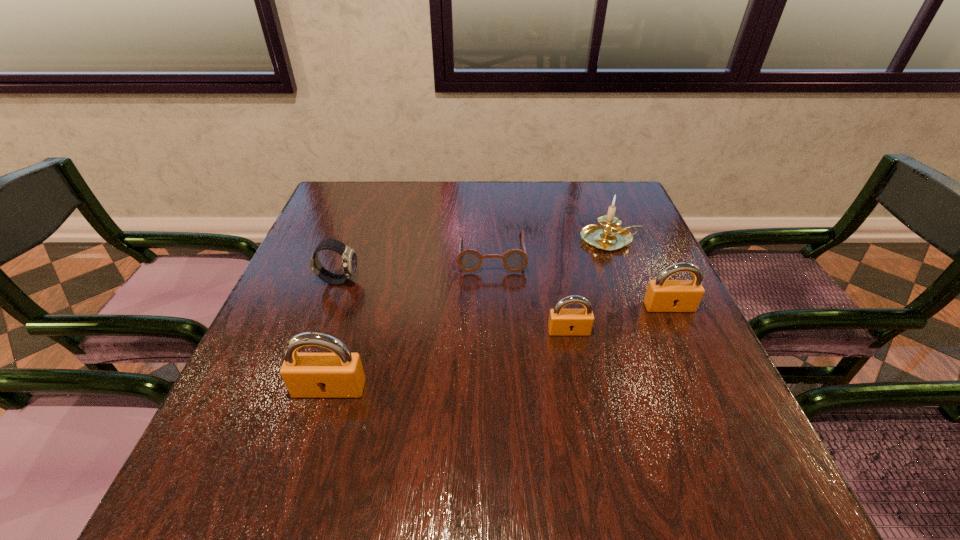
Image resolution: width=960 pixels, height=540 pixels. Find the location of `the nearest padlock`. the nearest padlock is located at coordinates (340, 374).

Locate an element on the screen. Image resolution: width=960 pixels, height=540 pixels. the tallest padlock is located at coordinates (340, 374).

This screenshot has width=960, height=540. Find the location of `the shortest padlock`. the shortest padlock is located at coordinates (562, 322).

This screenshot has width=960, height=540. What are the coordinates of `the fifth farthest object` in the screenshot? It's located at (562, 322).

Image resolution: width=960 pixels, height=540 pixels. I want to click on the second tallest padlock, so pyautogui.click(x=662, y=295).

Identify the location of the rightmost padlock. Image resolution: width=960 pixels, height=540 pixels. (662, 295).

At what (x,y) coordinates should I click in order to perform the action: click on watch. Please return your answer as a coordinate pair (x, y). The image size is (960, 540). Looking at the image, I should click on (349, 259).

You are a GUI agent. You are given a task and a screenshot of the screen. Output one action in this format:
    pyautogui.click(x=<x>, y=<y>)
    Task: Click on the candle holder
    The height and width of the screenshot is (540, 960).
    Given the screenshot: What is the action you would take?
    pyautogui.click(x=610, y=236)

Image resolution: width=960 pixels, height=540 pixels. Identify the location of the third object from left to right. (469, 260).

The image size is (960, 540). Identify the location of the shortest object. (469, 260).